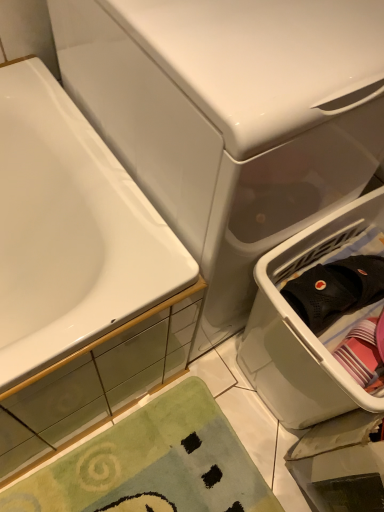
Identify the location of blank space situated above green plush bath mat at lower left (from a real-world perspective). Image resolution: width=384 pixels, height=512 pixels. (161, 464).